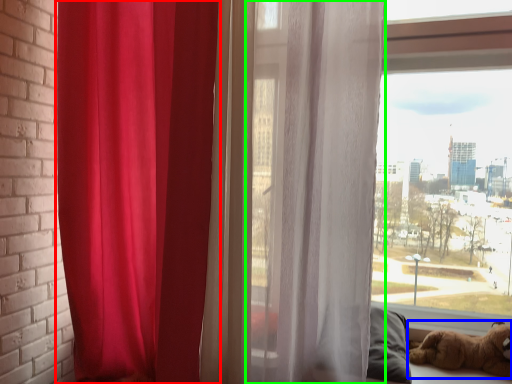
Question: Based on their relative distances, which object is farther from curtain (highlighted by a red box)? Choose from dog (highlighted by a blue box) and curtain (highlighted by a green box).

Choices:
 (A) dog
 (B) curtain

Answer: (A)